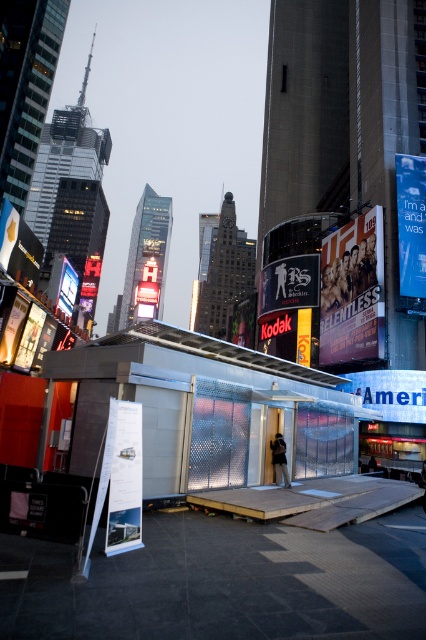
Based on the photo, you are a city planner assessing billboard dimensions for a new project. Given the scene in Times Square, which object from the list has a greater width between the matte kodak sign at center and the matte black monitor at upper left?

The matte kodak sign at center has a greater width than the matte black monitor at upper left according to the description.

You are an artist trying to sketch the scene. You notice the white paper at lower left and the blue fabric billboard at upper right. Which object should you draw first if you want to focus on the larger one first?

The blue fabric billboard at upper right is larger than the white paper at lower left, so you should draw the blue fabric billboard at upper right first.

You are a photographer trying to capture a clear shot of both the white paper at lower left and the matte black monitor at upper left. Considering their positions, which object should you focus on first to ensure both are in sharp focus?

Since the white paper at lower left is closer to the viewer than the matte black monitor at upper left, you should focus on the white paper at lower left first. This way, the depth of field will naturally cover the matte black monitor at upper left, keeping both in focus.